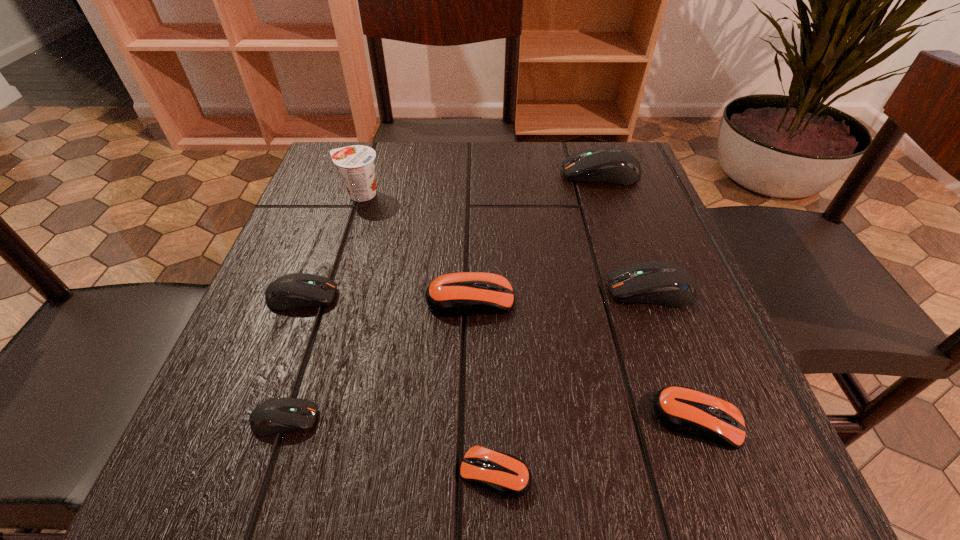
Identify the location of unoccupied area between the third tallest object and the farthest orange computer mouse. Image resolution: width=960 pixels, height=540 pixels. tap(561, 295).

The height and width of the screenshot is (540, 960). I want to click on free space between the biggest orange computer mouse and the sixth shortest computer mouse, so click(x=561, y=295).

Image resolution: width=960 pixels, height=540 pixels. I want to click on free space between the farthest orange computer mouse and the third smallest dark computer equipment, so click(561, 295).

What are the coordinates of `empty location between the third smallest dark computer equipment and the farthest orange computer mouse` in the screenshot? It's located at (561, 295).

You are a GUI agent. You are given a task and a screenshot of the screen. Output one action in this format:
    pyautogui.click(x=<x>, y=<y>)
    Task: Click on the empty space that is in between the farthest orange computer mouse and the smallest dark computer equipment
    This screenshot has width=960, height=540.
    Given the screenshot: What is the action you would take?
    pyautogui.click(x=377, y=359)

Identify the location of vacant area that lies between the third smallest dark computer equipment and the biggest orange computer mouse. (561, 295).

Locate which object ranks third in proximity to the biggest orange computer mouse. Please provide its 2D coordinates. Your answer should be formatted as a tuple, i.e. [(x, y)], where the tuple contains the x and y coordinates of a point satisfying the conditions above.

[(284, 414)]

Locate an element on the screen. object that is the third nearest to the rightmost orange computer mouse is located at coordinates (457, 294).

Choose which computer mouse is the fourth nearest neighbor to the second biggest dark computer equipment. Please provide its 2D coordinates. Your answer should be formatted as a tuple, i.e. [(x, y)], where the tuple contains the x and y coordinates of a point satisfying the conditions above.

[(506, 475)]

This screenshot has width=960, height=540. What are the coordinates of `computer mouse identified as the closest to the smallest dark computer equipment` in the screenshot? It's located at (296, 290).